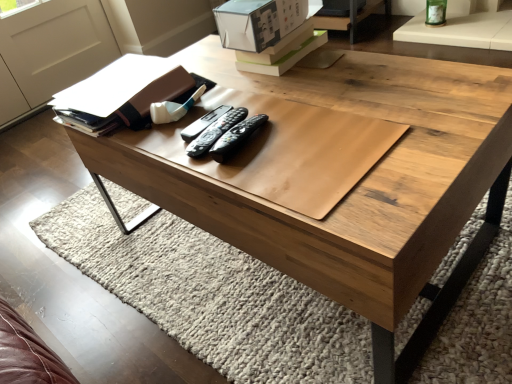
At what (x,y) coordinates should I click in order to perform the action: click on free location in front of black plastic remote at center, which ranks as the third remote in right-to-left order. Please return your answer as a coordinate pair (x, y). The height and width of the screenshot is (384, 512). Looking at the image, I should click on [x=242, y=170].